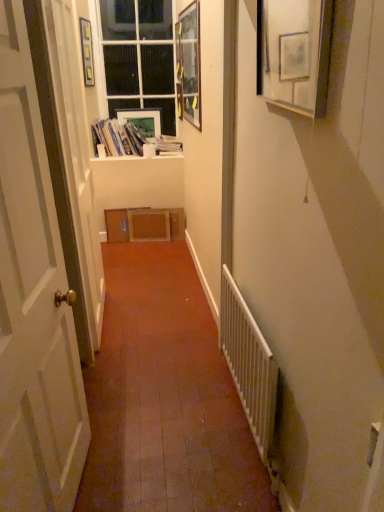
In order to face white wood window sill at upper center, should I rotate leftwards or rightwards?

You should rotate left by 7.187 degrees.

This screenshot has width=384, height=512. I want to click on white wood window sill at upper center, so click(x=138, y=158).

You are a GUI agent. You are given a task and a screenshot of the screen. Output one action in this format:
    pyautogui.click(x=<x>, y=<y>)
    Task: Click on the white paper stack at upper center
    This screenshot has width=384, height=512.
    Given the screenshot: What is the action you would take?
    pyautogui.click(x=119, y=138)

Describe the element at coordinates (189, 63) in the screenshot. I see `wooden picture frame at upper center, the second picture frame when ordered from front to back` at that location.

Identify the location of wooden picture frame at upper center, which is the 2th picture frame in right-to-left order. (189, 63).

Identify the location of matte plastic picture frame at upper center, marked as the 4th picture frame in a front-to-back arrangement. The width and height of the screenshot is (384, 512). (143, 120).

This screenshot has width=384, height=512. What do you see at coordinates (143, 120) in the screenshot?
I see `matte plastic picture frame at upper center, marked as the 4th picture frame in a front-to-back arrangement` at bounding box center [143, 120].

This screenshot has height=512, width=384. What are the coordinates of `matte black picture frame at upper left, which ranks as the 3th picture frame in front-to-back order` in the screenshot? It's located at (87, 52).

From a real-world perspective, is matte black picture frame at upper left, which ranks as the 1th picture frame in left-to-right order, positioned under wooden picture frame at upper center, which is the 2th picture frame in right-to-left order, based on gravity?

No, from a real-world perspective, matte black picture frame at upper left, which ranks as the 1th picture frame in left-to-right order, is not beneath wooden picture frame at upper center, which is the 2th picture frame in right-to-left order.

Is matte black picture frame at upper left, which ranks as the 1th picture frame in left-to-right order, far from wooden picture frame at upper center, which is the 2th picture frame in right-to-left order?

That's right, there is a large distance between matte black picture frame at upper left, which ranks as the 1th picture frame in left-to-right order, and wooden picture frame at upper center, which is the 2th picture frame in right-to-left order.

Which object is positioned more to the left, matte black picture frame at upper left, which ranks as the 1th picture frame in left-to-right order, or wooden picture frame at upper center, the second picture frame when ordered from front to back?

matte black picture frame at upper left, which ranks as the 1th picture frame in left-to-right order, is more to the left.

Considering the relative sizes of matte black picture frame at upper left, which is counted as the 2th picture frame, starting from the back, and wooden picture frame at upper center, which appears as the 3th picture frame when viewed from the back, in the image provided, is matte black picture frame at upper left, which is counted as the 2th picture frame, starting from the back, bigger than wooden picture frame at upper center, which appears as the 3th picture frame when viewed from the back,?

No, matte black picture frame at upper left, which is counted as the 2th picture frame, starting from the back, is not bigger than wooden picture frame at upper center, which appears as the 3th picture frame when viewed from the back.

Can you tell me how much white wood window sill at upper center and white metal radiator at lower right differ in facing direction?

The facing directions of white wood window sill at upper center and white metal radiator at lower right are 88.6 degrees apart.

Are white wood window sill at upper center and white metal radiator at lower right located far from each other?

Absolutely, white wood window sill at upper center is distant from white metal radiator at lower right.

From the image's perspective, is white wood window sill at upper center on white metal radiator at lower right?

Yes.

From the image's perspective, which object appears higher, white glossy door at left or white wood window sill at upper center?

white wood window sill at upper center, from the image's perspective.

Can you confirm if white glossy door at left is positioned to the right of white wood window sill at upper center?

Yes, white glossy door at left is to the right of white wood window sill at upper center.

Considering the relative sizes of white metal radiator at lower right and white glossy door at left in the image provided, is white metal radiator at lower right shorter than white glossy door at left?

Yes.

From the image's perspective, which is above, white metal radiator at lower right or white glossy door at left?

white glossy door at left.

Based on the photo, in the image, is white metal radiator at lower right positioned in front of or behind white glossy door at left?

Clearly, white metal radiator at lower right is behind white glossy door at left.

Is point (269, 370) positioned behind point (44, 266)?

Yes, it is.

Is matte black picture frame at upper left, which appears as the fourth picture frame when viewed from the right, taller than white paper stack at upper center?

Yes, matte black picture frame at upper left, which appears as the fourth picture frame when viewed from the right, is taller than white paper stack at upper center.

Locate an element on the screen. the 4th picture frame directly above the white paper stack at upper center (from a real-world perspective) is located at coordinates coord(87,52).

Considering the sizes of objects matte black picture frame at upper left, which appears as the fourth picture frame when viewed from the right, and white paper stack at upper center in the image provided, who is bigger, matte black picture frame at upper left, which appears as the fourth picture frame when viewed from the right, or white paper stack at upper center?

Bigger between the two is white paper stack at upper center.

Is white paper stack at upper center in contact with matte plastic picture frame at upper center, acting as the 2th picture frame starting from the left?

No, white paper stack at upper center is not in contact with matte plastic picture frame at upper center, acting as the 2th picture frame starting from the left.

From the image's perspective, is white paper stack at upper center located above or below matte plastic picture frame at upper center, which is counted as the first picture frame, starting from the back?

white paper stack at upper center is below matte plastic picture frame at upper center, which is counted as the first picture frame, starting from the back.

From a real-world perspective, which object rests below the other?

white paper stack at upper center is physically lower.

Is matte plastic picture frame at upper center, the third picture frame when ordered from right to left, at the back of white paper stack at upper center?

Yes, white paper stack at upper center is positioned with its back facing matte plastic picture frame at upper center, the third picture frame when ordered from right to left.

Looking at this image, from the image's perspective, which is below, matte black picture frame at upper left, which ranks as the 3th picture frame in front-to-back order, or wooden picture frame at upper right, the 4th picture frame when ordered from back to front?

wooden picture frame at upper right, the 4th picture frame when ordered from back to front, from the image's perspective.

Does matte black picture frame at upper left, which appears as the fourth picture frame when viewed from the right, have a lesser height compared to wooden picture frame at upper right, the 4th picture frame when ordered from back to front?

No.

Does matte black picture frame at upper left, which appears as the fourth picture frame when viewed from the right, contain wooden picture frame at upper right, the 4th picture frame when ordered from back to front?

Definitely not — wooden picture frame at upper right, the 4th picture frame when ordered from back to front, is not inside matte black picture frame at upper left, which appears as the fourth picture frame when viewed from the right.

From a real-world perspective, who is located lower, matte black picture frame at upper left, which ranks as the 1th picture frame in left-to-right order, or wooden picture frame at upper right, which is the 1th picture frame in right-to-left order?

wooden picture frame at upper right, which is the 1th picture frame in right-to-left order, is physically lower.

I want to click on picture frame that is the 2nd object above the wooden picture frame at upper center, positioned as the 3th picture frame in left-to-right order (from a real-world perspective), so click(87, 52).

In order to click on window sill above the white metal radiator at lower right (from the image's perspective) in this screenshot , I will do `click(138, 158)`.

Looking at the image, which one is located closer to wooden picture frame at upper right, the 4th picture frame when ordered from back to front, white metal radiator at lower right or white paper stack at upper center?

white metal radiator at lower right is closer to wooden picture frame at upper right, the 4th picture frame when ordered from back to front.

Based on their spatial positions, is wooden picture frame at upper right, arranged as the first picture frame when viewed from the front, or white metal radiator at lower right further from matte black picture frame at upper left, which appears as the fourth picture frame when viewed from the right?

Among the two, wooden picture frame at upper right, arranged as the first picture frame when viewed from the front, is located further to matte black picture frame at upper left, which appears as the fourth picture frame when viewed from the right.

From the picture: Which object lies nearer to the anchor point white wood window sill at upper center, white metal radiator at lower right or matte plastic picture frame at upper center, marked as the 4th picture frame in a front-to-back arrangement?

matte plastic picture frame at upper center, marked as the 4th picture frame in a front-to-back arrangement, is positioned closer to the anchor white wood window sill at upper center.

Estimate the real-world distances between objects in this image. Which object is further from matte plastic picture frame at upper center, acting as the 2th picture frame starting from the left, white metal radiator at lower right or white glass window at upper center?

white metal radiator at lower right lies further to matte plastic picture frame at upper center, acting as the 2th picture frame starting from the left, than the other object.

Looking at the image, which one is located closer to wooden picture frame at upper center, which appears as the 3th picture frame when viewed from the back, matte plastic picture frame at upper center, marked as the 4th picture frame in a front-to-back arrangement, or matte black picture frame at upper left, which is counted as the 2th picture frame, starting from the back?

matte plastic picture frame at upper center, marked as the 4th picture frame in a front-to-back arrangement, is positioned closer to the anchor wooden picture frame at upper center, which appears as the 3th picture frame when viewed from the back.

From the picture: Which object lies further to the anchor point wooden picture frame at upper center, the second picture frame when ordered from front to back, wooden picture frame at upper right, which is the 1th picture frame in right-to-left order, or white wood window sill at upper center?

The object further to wooden picture frame at upper center, the second picture frame when ordered from front to back, is wooden picture frame at upper right, which is the 1th picture frame in right-to-left order.

Looking at the image, which one is located further to white glass window at upper center, white glossy door at left or wooden picture frame at upper right, arranged as the first picture frame when viewed from the front?

white glossy door at left lies further to white glass window at upper center than the other object.

In the scene shown: Estimate the real-world distances between objects in this image. Which object is closer to wooden picture frame at upper center, which appears as the 3th picture frame when viewed from the back, white wood window sill at upper center or wooden picture frame at upper right, arranged as the first picture frame when viewed from the front?

white wood window sill at upper center is closer to wooden picture frame at upper center, which appears as the 3th picture frame when viewed from the back.

This screenshot has height=512, width=384. Identify the location of window sill located between wooden picture frame at upper center, which appears as the 3th picture frame when viewed from the back, and matte plastic picture frame at upper center, the third picture frame when ordered from right to left, in the depth direction. (138, 158).

Identify the location of window between wooden picture frame at upper center, which is the 2th picture frame in right-to-left order, and white wood window sill at upper center in the front-back direction. This screenshot has height=512, width=384. point(139,57).

You are a GUI agent. You are given a task and a screenshot of the screen. Output one action in this format:
    pyautogui.click(x=<x>, y=<y>)
    Task: Click on the window between wooden picture frame at upper right, arranged as the first picture frame when viewed from the front, and white wood window sill at upper center in the front-back direction
    
    Given the screenshot: What is the action you would take?
    pyautogui.click(x=139, y=57)

The image size is (384, 512). I want to click on radiator positioned between white glossy door at left and white paper stack at upper center from near to far, so click(x=250, y=367).